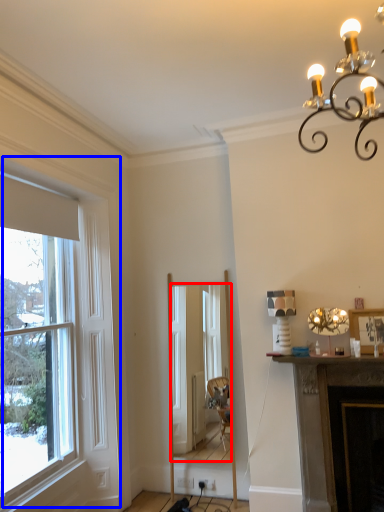
Question: Among these objects, which one is farthest to the camera, mirror (highlighted by a red box) or window (highlighted by a blue box)?

Choices:
 (A) mirror
 (B) window

Answer: (A)